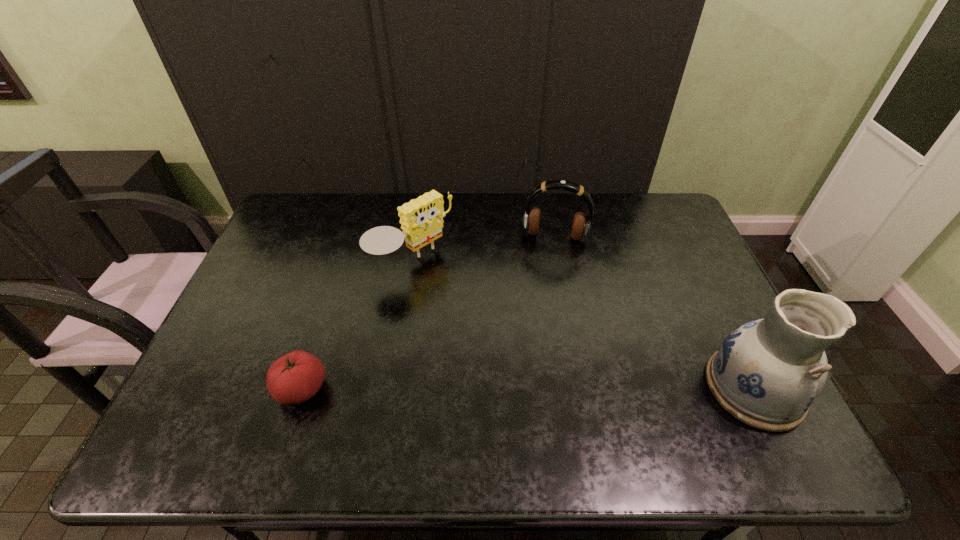
Locate an element on the screen. vacant space that satisfies the following two spatial constraints: 1. on the front side of the headset; 2. on the left side of the tallest object is located at coordinates (583, 388).